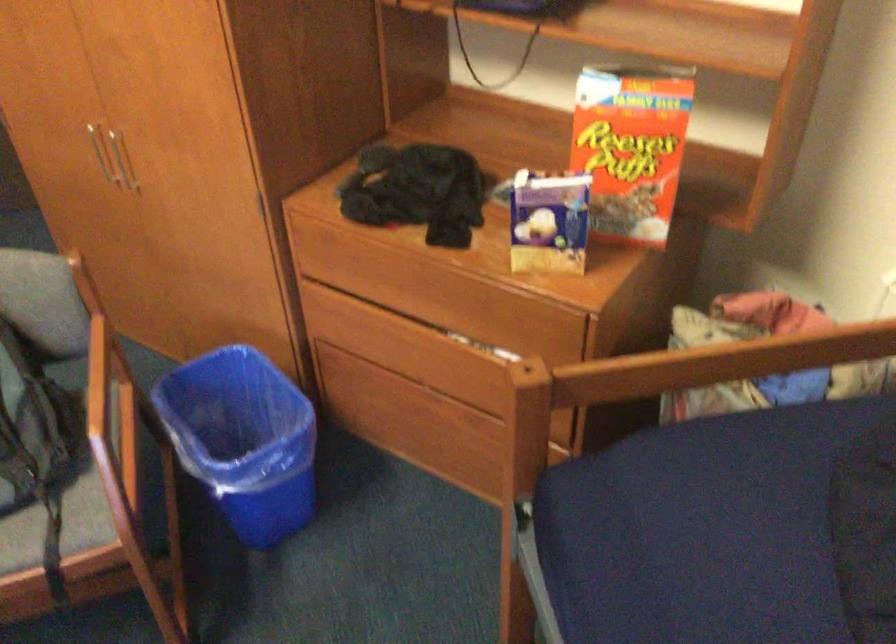
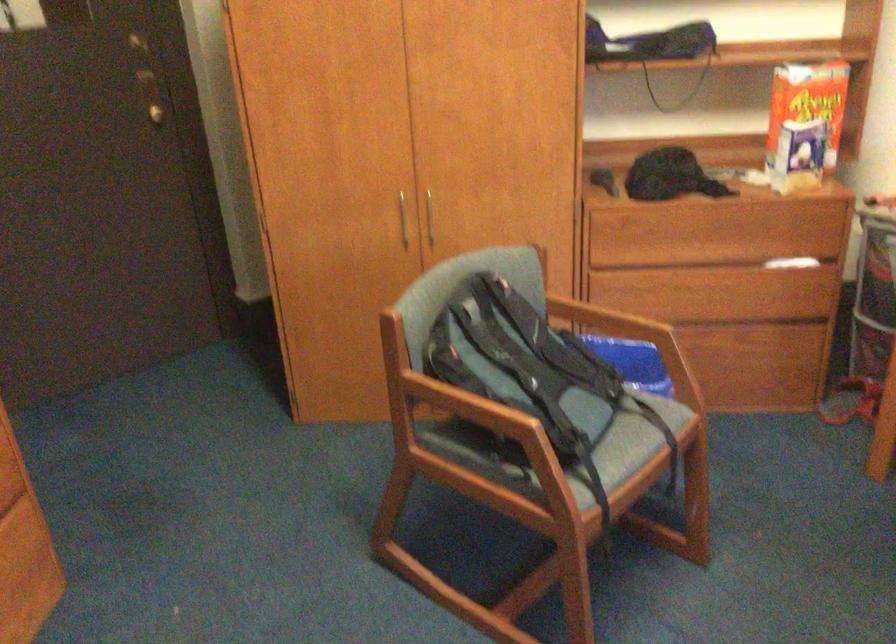
In the second image, find the point that corresponds to [416,286] in the first image.

(702, 232)